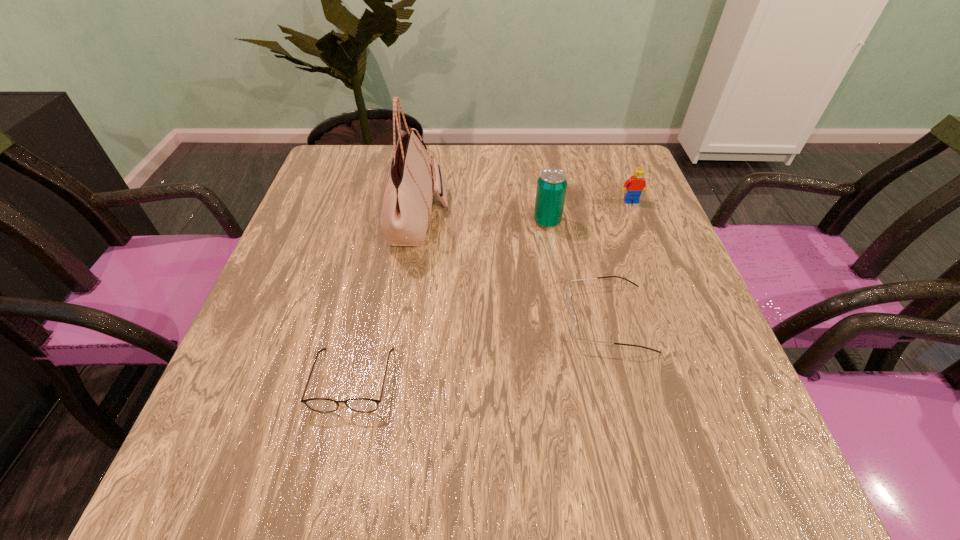
Locate an element on the screen. This screenshot has height=540, width=960. empty space between the right spectacles and the shortest object is located at coordinates (x=480, y=349).

I want to click on empty space that is in between the Lego and the beer can, so click(x=589, y=211).

The height and width of the screenshot is (540, 960). What are the coordinates of `free space between the shorter spectacles and the Lego` in the screenshot? It's located at (492, 291).

Locate an element on the screen. The image size is (960, 540). vacant area that lies between the shorter spectacles and the right spectacles is located at coordinates (480, 349).

I want to click on object identified as the third closest to the handbag, so click(572, 322).

The width and height of the screenshot is (960, 540). What are the coordinates of `the fourth closest object relative to the beer can` in the screenshot? It's located at (364, 405).

The height and width of the screenshot is (540, 960). In order to click on free spot that satisfies the following two spatial constraints: 1. on the side of the tallest object with the attached pouch; 2. on the front-facing side of the shortest object in this screenshot , I will do `click(394, 380)`.

Where is `vacant region that satisfies the following two spatial constraints: 1. through the lenses of the right spectacles; 2. on the front-facing side of the shortest object`? The image size is (960, 540). vacant region that satisfies the following two spatial constraints: 1. through the lenses of the right spectacles; 2. on the front-facing side of the shortest object is located at coordinates (623, 380).

Locate an element on the screen. free location that satisfies the following two spatial constraints: 1. on the face of the third shortest object; 2. through the lenses of the right spectacles is located at coordinates (677, 318).

Where is `vacant area in the image that satisfies the following two spatial constraints: 1. on the back side of the beer can; 2. on the side of the handbag with the attached pouch`? Image resolution: width=960 pixels, height=540 pixels. vacant area in the image that satisfies the following two spatial constraints: 1. on the back side of the beer can; 2. on the side of the handbag with the attached pouch is located at coordinates pyautogui.click(x=546, y=218).